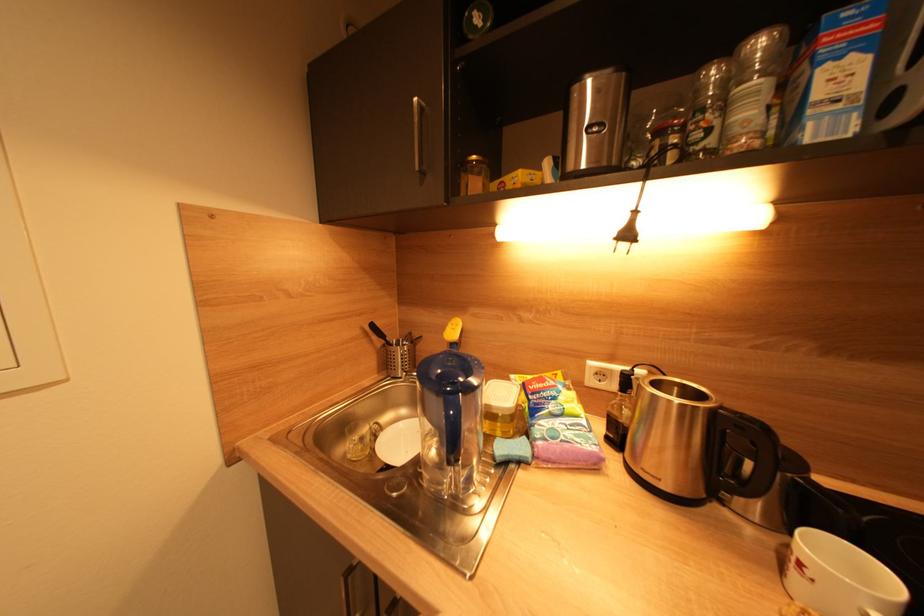
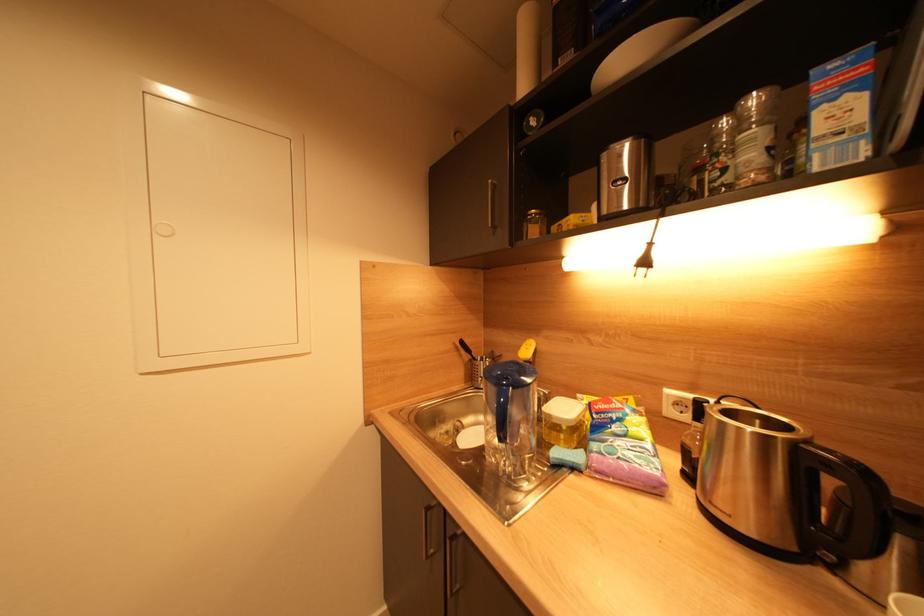
Which direction would the cameraman need to move to produce the second image?

The movement direction of the cameraman is right, backward.